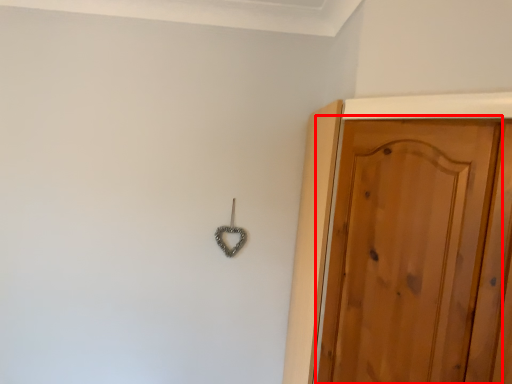
Question: From the image's perspective, considering the relative positions of door (annotated by the red box) and hook in the image provided, where is door (annotated by the red box) located with respect to the staircase?

Choices:
 (A) above
 (B) below

Answer: (B)